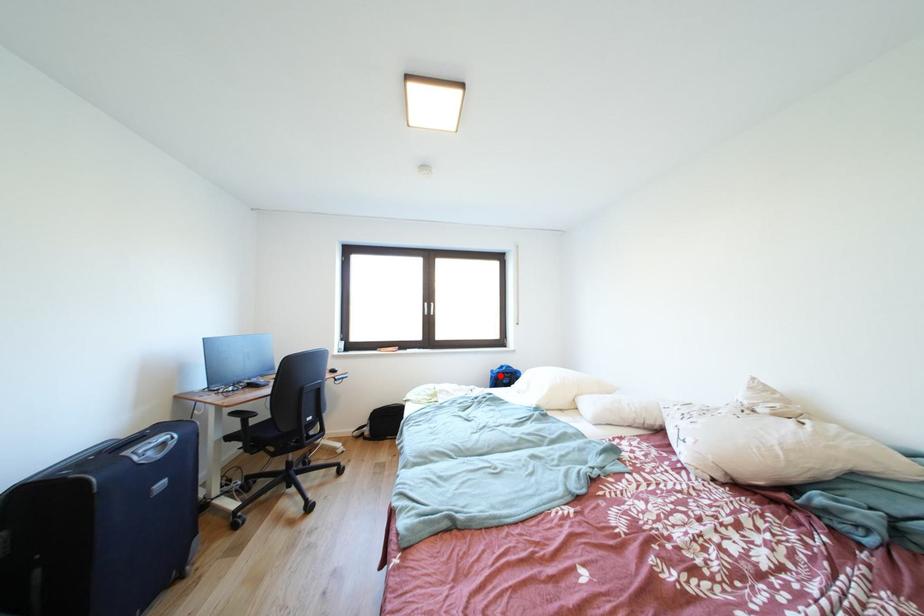
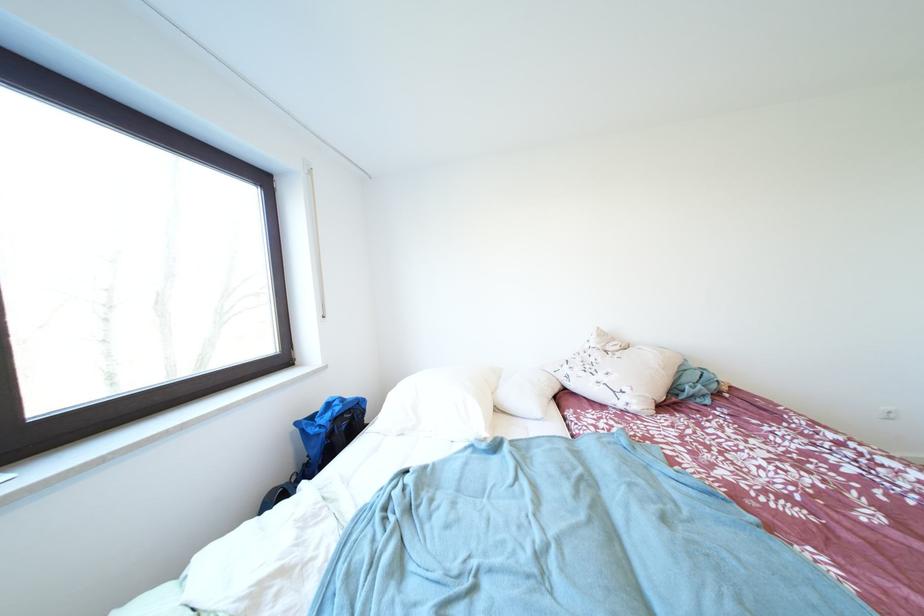
Where in the second image is the point corresponding to the highlighted location from the first image?

(305, 428)